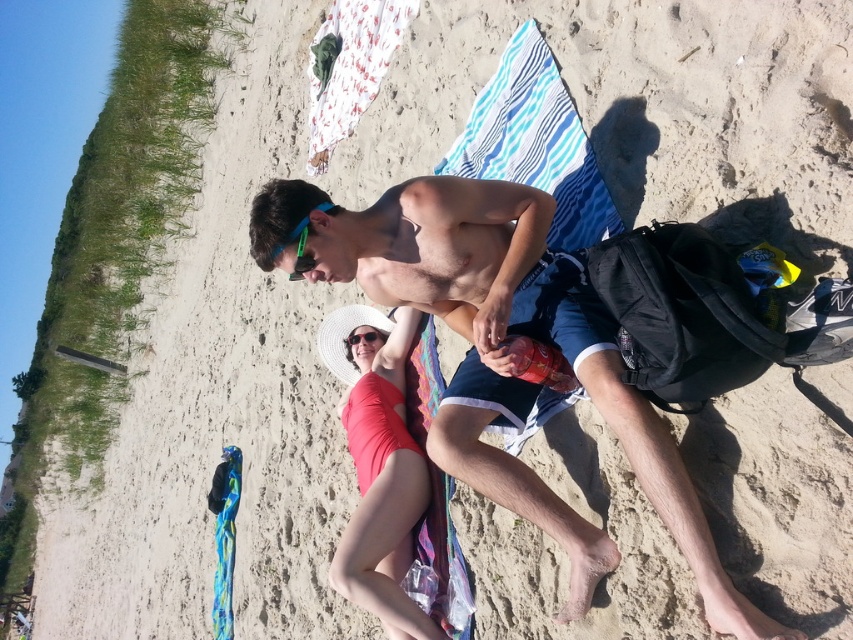
Based on the photo, you are a photographer standing at the beach scene. You want to capture a photo of the shiny metallic can at center and the green rubber earbuds at upper center. Which object should you focus on first to ensure both are in the frame?

The shiny metallic can at center is in front of the green rubber earbuds at upper center, so you should focus on the shiny metallic can at center first to ensure both are in the frame.

You are a photographer on the beach and want to capture both the white woven hat at center and the green rubber earbuds at upper center in a single shot. Given their sizes, which object will appear bigger in the photo?

The white woven hat at center will appear bigger in the photo because it is larger in size than the green rubber earbuds at upper center.

You are standing at the origin point of the beach scene. You want to place a new beach umbrella exactly 0.3 units to the right of the white woven hat at center. What are the coordinates where you should place the new beach umbrella?

The white woven hat at center is located at coordinates point (378, 465). To place the umbrella 0.3 units to the right, add 0.3 to the x coordinate. The new coordinates would be (378, 639).